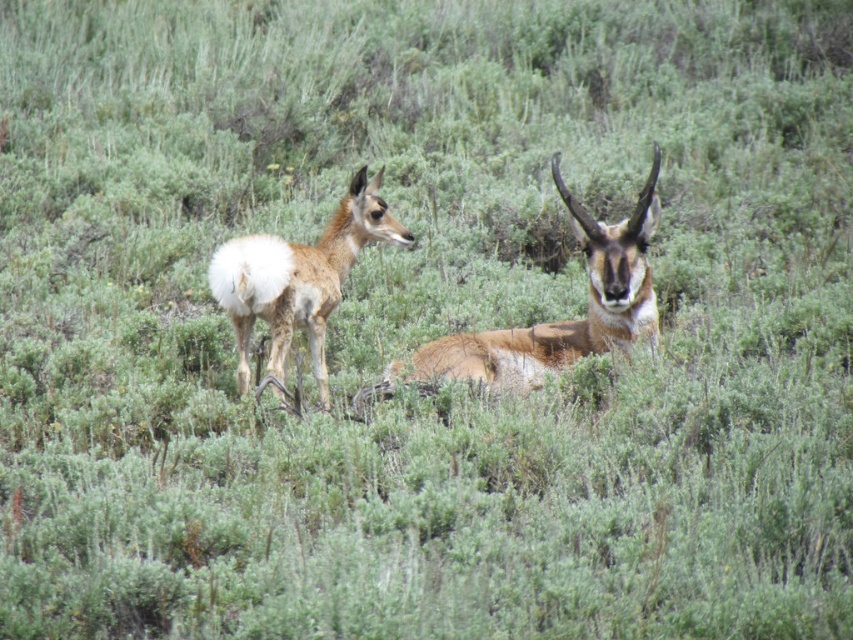
Looking at this image, which is below, brown fuzzy antelope at center or brown fur antelope at center?

brown fuzzy antelope at center is below.

Does brown fuzzy antelope at center have a lesser height compared to brown fur antelope at center?

Yes.

At what (x,y) coordinates should I click in order to perform the action: click on brown fuzzy antelope at center. Please return your answer as a coordinate pair (x, y). Looking at the image, I should click on (566, 321).